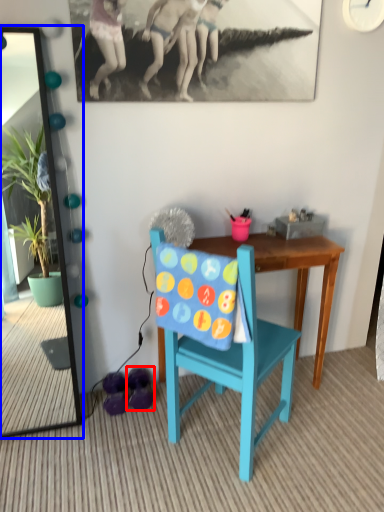
Question: Which object is closer to the camera taking this photo, footwear (highlighted by a red box) or mirror (highlighted by a blue box)?

Choices:
 (A) footwear
 (B) mirror

Answer: (B)